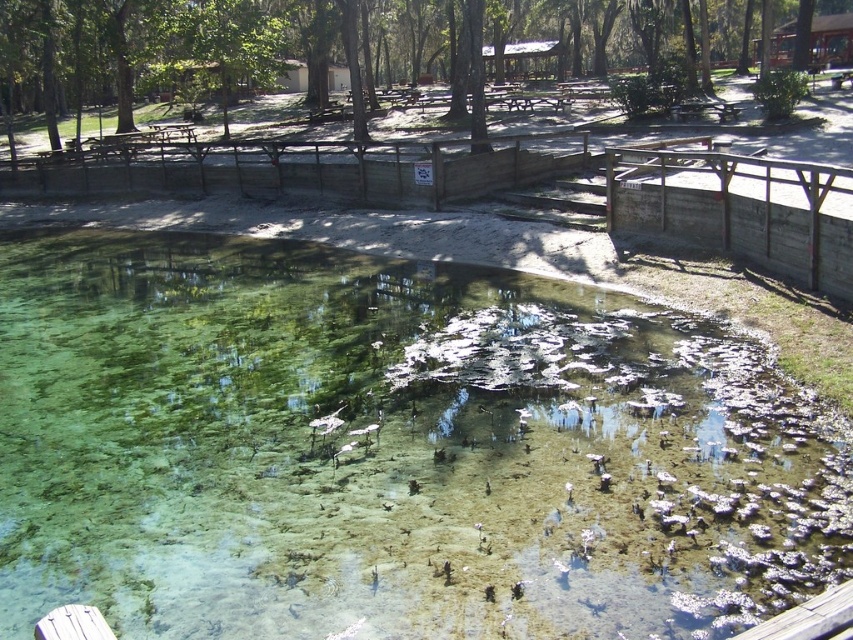
You are standing on the wooden walkway and want to take a photo of the clear water at center. To avoid having the green leafy tree at upper center block the sunlight, where should you position yourself relative to the tree?

Position yourself so the green leafy tree at upper center is behind you when photographing the clear water at center, as the clear water at center is positioned under the green leafy tree at upper center.

You are standing at the wooden walkway in the serene outdoor scene. You see two points marked on the path ahead. The first point is at coordinates point (x=259, y=440) and the second is at point (x=663, y=60). Which point is closer to you as you face the direction the walkway is leading?

Point (x=259, y=440) is in front of point (x=663, y=60), so it is closer to you as you face the direction the walkway is leading.

You are a park ranger planning to install a safety barrier between the clear water at center and the green leafy tree at upper center. The barrier requires a minimum of 30 meters of fencing material. Do you have enough material if you only have 30 meters available?

The clear water at center and green leafy tree at upper center are 31.80 meters apart, so you need at least 31.80 meters of fencing material. With only 30 meters available, you do not have enough material.